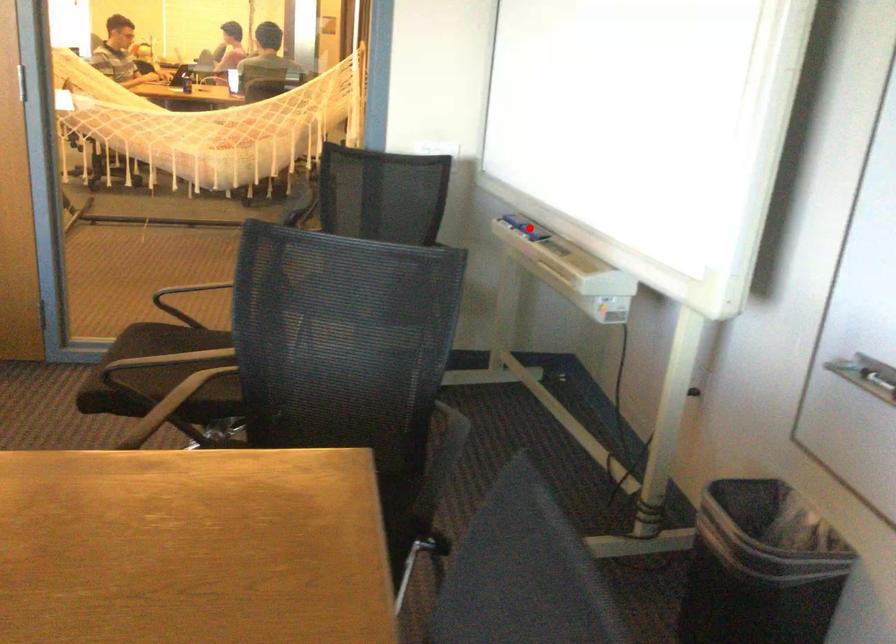
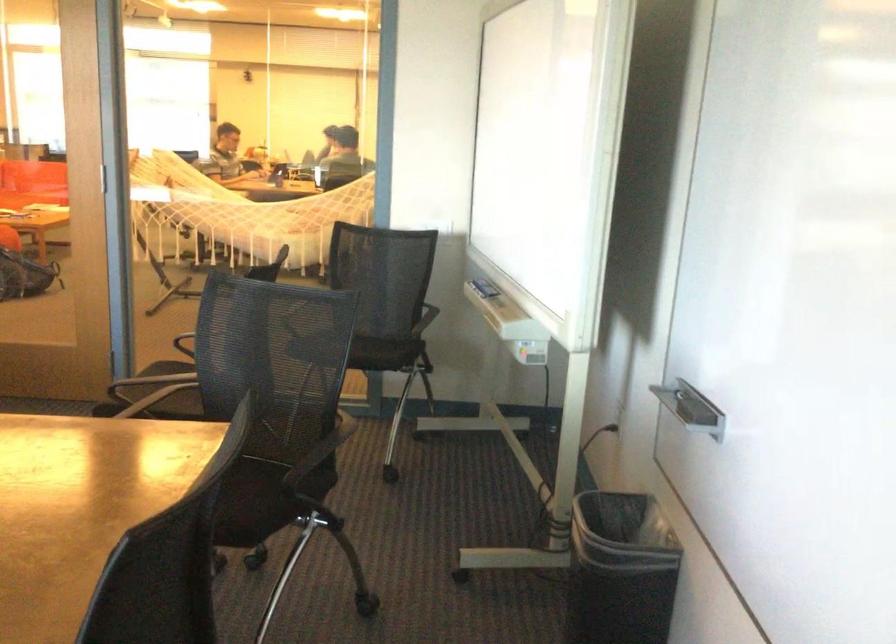
Question: A red point is marked in image1. In image2, is the corresponding 3D point closer to the camera or farther? Reply with the corresponding letter.

Choices:
 (A) The corresponding 3D point is closer.
 (B) The corresponding 3D point is farther.

Answer: (B)